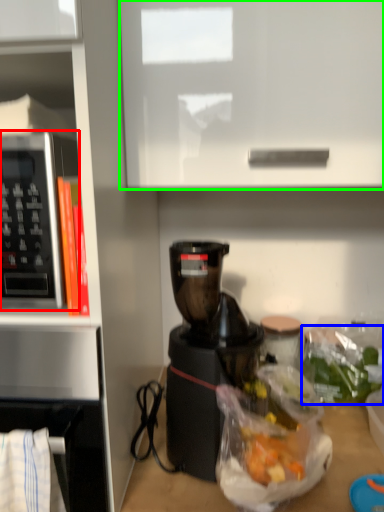
Question: Which object is the farthest from microwave oven (highlighted by a red box)? Choose among these: food (highlighted by a blue box) or cabinetry (highlighted by a green box).

Choices:
 (A) food
 (B) cabinetry

Answer: (A)